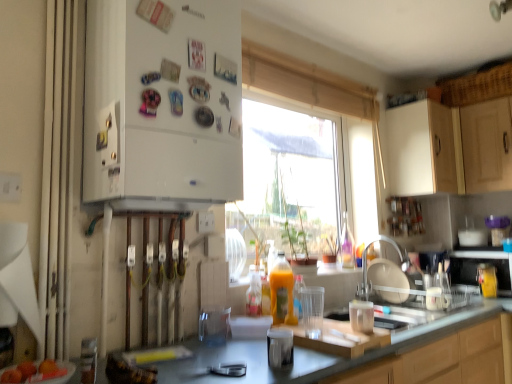
Image resolution: width=512 pixels, height=384 pixels. Describe the element at coordinates (478, 264) in the screenshot. I see `metallic silver microwave at right, acting as the second appliance starting from the front` at that location.

Describe the element at coordinates (58, 175) in the screenshot. I see `white fabric curtain at left` at that location.

Describe the element at coordinates (386, 273) in the screenshot. The height and width of the screenshot is (384, 512). I see `satin nickel faucet at sink right` at that location.

At what (x,y) coordinates should I click in order to perform the action: click on transparent plastic coffee machine at right. Please return your answer as a coordinate pair (x, y). The image size is (512, 384). Looking at the image, I should click on (435, 280).

Describe the element at coordinates (312, 89) in the screenshot. I see `translucent wood window at center` at that location.

Identify the location of white matte refrigerator at left, placed as the second cabinetry when sorted from right to left. (162, 104).

From a real-world perspective, is metallic silver microwave at right, which is the 2th appliance in left-to-right order, physically below white matte cabinet at upper right, marked as the 1th cabinetry in a back-to-front arrangement?

Yes, from a real-world perspective, metallic silver microwave at right, which is the 2th appliance in left-to-right order, is below white matte cabinet at upper right, marked as the 1th cabinetry in a back-to-front arrangement.

Is metallic silver microwave at right, which is the 2th appliance in left-to-right order, not near white matte cabinet at upper right, which ranks as the 2th cabinetry in front-to-back order?

No.

Is white matte cabinet at upper right, marked as the 1th cabinetry in a back-to-front arrangement, inside metallic silver microwave at right, which is the 2th appliance in left-to-right order?

Actually, white matte cabinet at upper right, marked as the 1th cabinetry in a back-to-front arrangement, is outside metallic silver microwave at right, which is the 2th appliance in left-to-right order.

Which is behind, translucent plastic bottle at center or white matte refrigerator at left, the second cabinetry from the back?

translucent plastic bottle at center is further away from the camera.

Is translucent plastic bottle at center oriented towards white matte refrigerator at left, the 1th cabinetry positioned from the left?

No, translucent plastic bottle at center is not oriented towards white matte refrigerator at left, the 1th cabinetry positioned from the left.

From a real-world perspective, which object rests below the other?

translucent plastic bottle at center is physically lower.

The image size is (512, 384). There is a smooth black countertop at center. Identify the location of the 1st cabinetry above it (from a real-world perspective). (162, 104).

From the image's perspective, which one is positioned lower, smooth black countertop at center or white matte refrigerator at left, the second cabinetry from the back?

smooth black countertop at center.

Based on the photo, measure the distance between smooth black countertop at center and white matte refrigerator at left, the 1th cabinetry in the front-to-back sequence.

smooth black countertop at center and white matte refrigerator at left, the 1th cabinetry in the front-to-back sequence, are 34.45 inches apart.

From a real-world perspective, who is located higher, smooth black countertop at center or white matte refrigerator at left, the 1th cabinetry positioned from the left?

white matte refrigerator at left, the 1th cabinetry positioned from the left.

Is smooth black countertop at center smaller than translucent plastic bottle at center?

Actually, smooth black countertop at center might be larger than translucent plastic bottle at center.

Is smooth black countertop at center placed right next to translucent plastic bottle at center?

smooth black countertop at center and translucent plastic bottle at center are clearly separated.

How many degrees apart are the facing directions of smooth black countertop at center and translucent plastic bottle at center?

0.771 degrees separate the facing orientations of smooth black countertop at center and translucent plastic bottle at center.

This screenshot has width=512, height=384. In the image, there is a smooth black countertop at center. In order to click on bottle above it (from the image's perspective) in this screenshot , I will do `click(282, 291)`.

How much distance is there between translucent glass cup at center, acting as the 1th appliance starting from the front, and transparent plastic coffee machine at right?

4.06 feet.

From the image's perspective, is translucent glass cup at center, which appears as the second appliance when viewed from the back, located above transparent plastic coffee machine at right?

Yes.

From a real-world perspective, relative to transparent plastic coffee machine at right, is translucent glass cup at center, which appears as the second appliance when viewed from the back, vertically above or below?

From a real-world perspective, translucent glass cup at center, which appears as the second appliance when viewed from the back, is physically below transparent plastic coffee machine at right.

Based on their positions, is translucent glass cup at center, acting as the 1th appliance starting from the front, located to the left or right of transparent plastic coffee machine at right?

In the image, translucent glass cup at center, acting as the 1th appliance starting from the front, appears on the left side of transparent plastic coffee machine at right.

Considering the positions of objects translucent glass cup at center, the 2th appliance from the right, and white matte refrigerator at left, placed as the second cabinetry when sorted from right to left, in the image provided, who is more to the right, translucent glass cup at center, the 2th appliance from the right, or white matte refrigerator at left, placed as the second cabinetry when sorted from right to left,?

From the viewer's perspective, translucent glass cup at center, the 2th appliance from the right, appears more on the right side.

How many degrees apart are the facing directions of translucent glass cup at center, acting as the 1th appliance starting from the front, and white matte refrigerator at left, the 1th cabinetry in the front-to-back sequence?

110 degrees separate the facing orientations of translucent glass cup at center, acting as the 1th appliance starting from the front, and white matte refrigerator at left, the 1th cabinetry in the front-to-back sequence.

Is white matte refrigerator at left, placed as the second cabinetry when sorted from right to left, at the back of translucent glass cup at center, which is counted as the 1th appliance, starting from the left?

translucent glass cup at center, which is counted as the 1th appliance, starting from the left, is not turned away from white matte refrigerator at left, placed as the second cabinetry when sorted from right to left.

From the image's perspective, which one is positioned higher, translucent glass cup at center, the 2th appliance from the right, or white matte refrigerator at left, the second cabinetry from the back?

white matte refrigerator at left, the second cabinetry from the back.

Between translucent glass cup at center, the 2th appliance from the right, and metallic silver microwave at right, which is the 1th appliance from back to front, which one has smaller width?

translucent glass cup at center, the 2th appliance from the right, is thinner.

Visually, is translucent glass cup at center, which appears as the second appliance when viewed from the back, positioned to the left or to the right of metallic silver microwave at right, acting as the second appliance starting from the front?

translucent glass cup at center, which appears as the second appliance when viewed from the back, is positioned on metallic silver microwave at right, acting as the second appliance starting from the front,'s left side.

Considering the sizes of translucent glass cup at center, the 2th appliance from the right, and metallic silver microwave at right, which is the 1th appliance from back to front, in the image, is translucent glass cup at center, the 2th appliance from the right, bigger or smaller than metallic silver microwave at right, which is the 1th appliance from back to front,?

Considering their sizes, translucent glass cup at center, the 2th appliance from the right, takes up less space than metallic silver microwave at right, which is the 1th appliance from back to front.

Can you confirm if translucent glass cup at center, which is counted as the 1th appliance, starting from the left, is taller than metallic silver microwave at right, acting as the second appliance starting from the front?

No, translucent glass cup at center, which is counted as the 1th appliance, starting from the left, is not taller than metallic silver microwave at right, acting as the second appliance starting from the front.

Where is `appliance on the right of white matte cabinet at upper right, acting as the 1th cabinetry starting from the right`? appliance on the right of white matte cabinet at upper right, acting as the 1th cabinetry starting from the right is located at coordinates (478, 264).

Locate an element on the screen. This screenshot has width=512, height=384. cabinetry on the left of translucent plastic bottle at center is located at coordinates (162, 104).

From the image, which object appears to be nearer to transparent plastic coffee machine at right, smooth black countertop at center or satin nickel faucet at sink right?

The object closer to transparent plastic coffee machine at right is satin nickel faucet at sink right.

Considering their positions, is translucent plastic bottle at center positioned closer to smooth orange fruit at lower left than satin nickel faucet at sink right?

The object closer to smooth orange fruit at lower left is translucent plastic bottle at center.

When comparing their distances from translucent glass cup at center, which is counted as the 1th appliance, starting from the left, does satin nickel faucet at sink right or smooth orange fruit at lower left seem closer?

Among the two, smooth orange fruit at lower left is located nearer to translucent glass cup at center, which is counted as the 1th appliance, starting from the left.

When comparing their distances from satin nickel faucet at sink right, does translucent glass cup at center, which is counted as the 1th appliance, starting from the left, or transparent plastic coffee machine at right seem further?

Among the two, translucent glass cup at center, which is counted as the 1th appliance, starting from the left, is located further to satin nickel faucet at sink right.

Considering their positions, is translucent glass cup at center, which is counted as the 1th appliance, starting from the left, positioned further to smooth orange fruit at lower left than white matte refrigerator at left, placed as the second cabinetry when sorted from right to left?

white matte refrigerator at left, placed as the second cabinetry when sorted from right to left, lies further to smooth orange fruit at lower left than the other object.

Considering their positions, is smooth black countertop at center positioned closer to metallic silver microwave at right, which is the 1th appliance from back to front, than translucent plastic bottle at center?

smooth black countertop at center.

When comparing their distances from metallic silver microwave at right, acting as the second appliance starting from the front, does translucent wood window at center or white fabric curtain at left seem closer?

Based on the image, translucent wood window at center appears to be nearer to metallic silver microwave at right, acting as the second appliance starting from the front.

Which object lies further to the anchor point white matte cabinet at upper right, acting as the 1th cabinetry starting from the right, translucent wood window at center or smooth orange fruit at lower left?

The object further to white matte cabinet at upper right, acting as the 1th cabinetry starting from the right, is smooth orange fruit at lower left.

Locate an element on the screen. coffee machine between white fabric curtain at left and white matte cabinet at upper right, which ranks as the 2th cabinetry in front-to-back order is located at coordinates (435, 280).

Locate an element on the screen. bottle positioned between smooth black countertop at center and satin nickel faucet at sink right from near to far is located at coordinates (282, 291).

This screenshot has height=384, width=512. What are the coordinates of `bottle between white matte refrigerator at left, the 1th cabinetry positioned from the left, and smooth orange fruit at lower left from top to bottom` in the screenshot? It's located at (x=282, y=291).

The height and width of the screenshot is (384, 512). I want to click on bottle between smooth orange fruit at lower left and smooth black countertop at center, so [x=282, y=291].